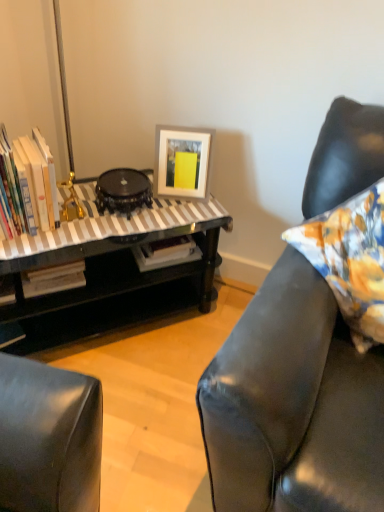
The height and width of the screenshot is (512, 384). Identify the location of blank space situated above black glossy table at left (from a real-world perspective). (94, 215).